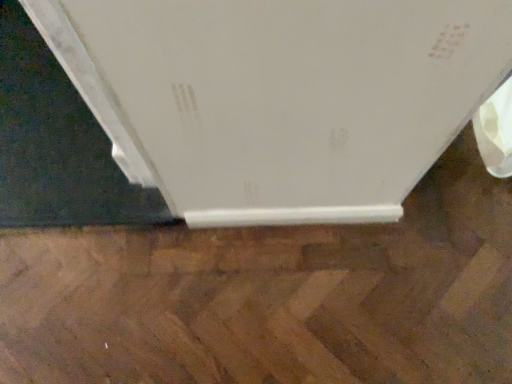
Identify the location of brown polished wood at lower center. (272, 296).

The height and width of the screenshot is (384, 512). What do you see at coordinates (272, 296) in the screenshot?
I see `brown polished wood at lower center` at bounding box center [272, 296].

The image size is (512, 384). In order to click on brown polished wood at lower center in this screenshot , I will do `click(272, 296)`.